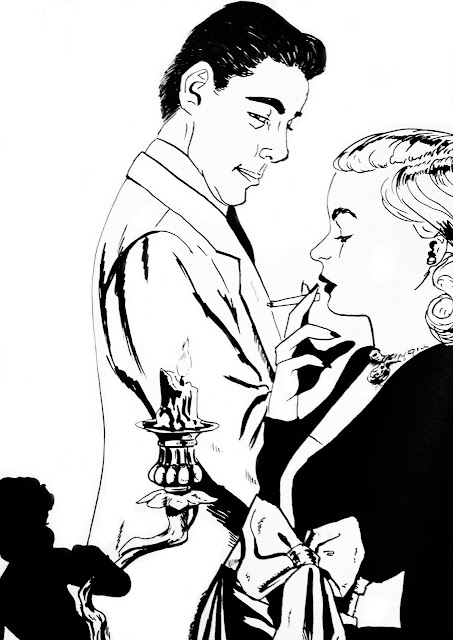
The width and height of the screenshot is (453, 640). Identify the location of candle holder. (180, 502), (169, 457).